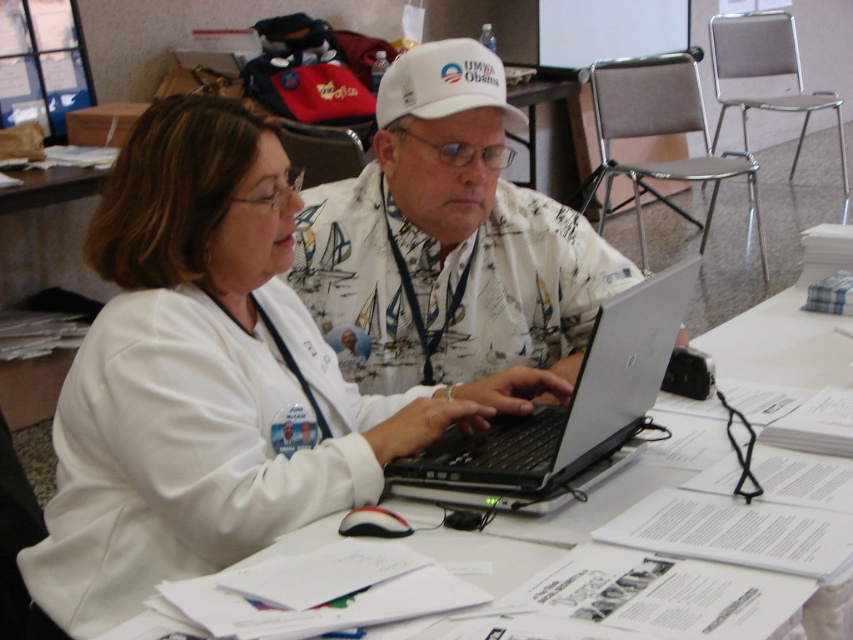
From the picture: Does white fabric shirt at center have a larger size compared to silver/black keyboard at center?

Indeed, white fabric shirt at center has a larger size compared to silver/black keyboard at center.

Does point (462, 364) come closer to viewer compared to point (647, 285)?

No, (462, 364) is behind (647, 285).

Find the location of a particular element. white fabric shirt at center is located at coordinates (447, 241).

Where is `silver/black keyboard at center`? Image resolution: width=853 pixels, height=640 pixels. silver/black keyboard at center is located at coordinates (563, 412).

Who is positioned more to the right, silver/black keyboard at center or white fabric baseball cap at center?

silver/black keyboard at center is more to the right.

What do you see at coordinates (563, 412) in the screenshot? The image size is (853, 640). I see `silver/black keyboard at center` at bounding box center [563, 412].

Locate an element on the screen. This screenshot has height=640, width=853. silver/black keyboard at center is located at coordinates (563, 412).

Who is positioned more to the left, white paper at center or white fabric baseball cap at center?

white fabric baseball cap at center is more to the left.

Between white paper at center and white fabric baseball cap at center, which one is positioned higher?

white fabric baseball cap at center is higher up.

The image size is (853, 640). What do you see at coordinates (776, 355) in the screenshot?
I see `white paper at center` at bounding box center [776, 355].

At what (x,y) coordinates should I click in order to perform the action: click on white paper at center. Please return your answer as a coordinate pair (x, y). The image size is (853, 640). Looking at the image, I should click on (776, 355).